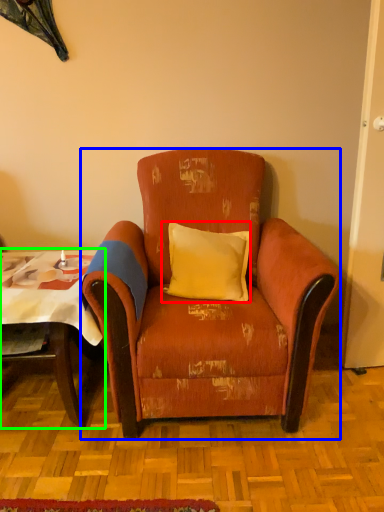
Question: Which object is the closest to the pillow (highlighted by a red box)? Choose among these: chair (highlighted by a blue box) or table (highlighted by a green box).

Choices:
 (A) chair
 (B) table

Answer: (A)